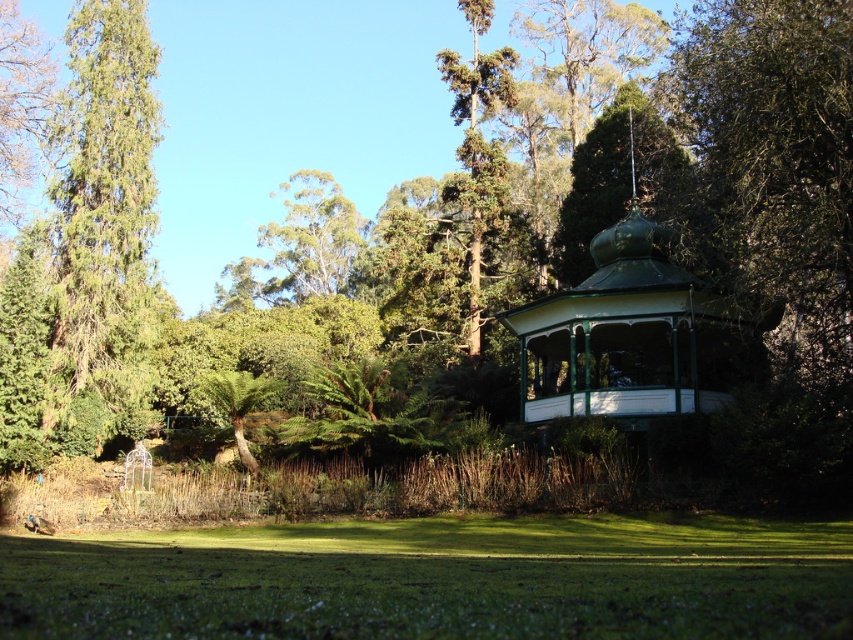
Between green grassy field at lower center and green textured tree at left, which one is positioned higher?

green textured tree at left

Who is positioned more to the left, green grassy field at lower center or green textured tree at left?

From the viewer's perspective, green textured tree at left appears more on the left side.

Between point (358, 609) and point (73, 51), which one is positioned in front?

Positioned in front is point (358, 609).

Where is `green grassy field at lower center`? This screenshot has height=640, width=853. green grassy field at lower center is located at coordinates (436, 579).

Is green grassy field at lower center bigger than green painted wood gazebo at center right?

No, green grassy field at lower center is not bigger than green painted wood gazebo at center right.

Is green grassy field at lower center thinner than green painted wood gazebo at center right?

No.

Is point (524, 609) positioned behind point (662, 168)?

No.

You are a GUI agent. You are given a task and a screenshot of the screen. Output one action in this format:
    pyautogui.click(x=<x>, y=<y>)
    Task: Click on the green grassy field at lower center
    This screenshot has width=853, height=640.
    Given the screenshot: What is the action you would take?
    pyautogui.click(x=436, y=579)

Between point (672, 432) and point (126, 230), which one is positioned in front?

Point (672, 432) is in front.

Is green painted wood gazebo at center right positioned behind green textured tree at left?

No, it is in front of green textured tree at left.

Which is in front, point (706, 301) or point (84, 4)?

Point (706, 301) is more forward.

This screenshot has height=640, width=853. What are the coordinates of `green painted wood gazebo at center right` in the screenshot? It's located at (630, 298).